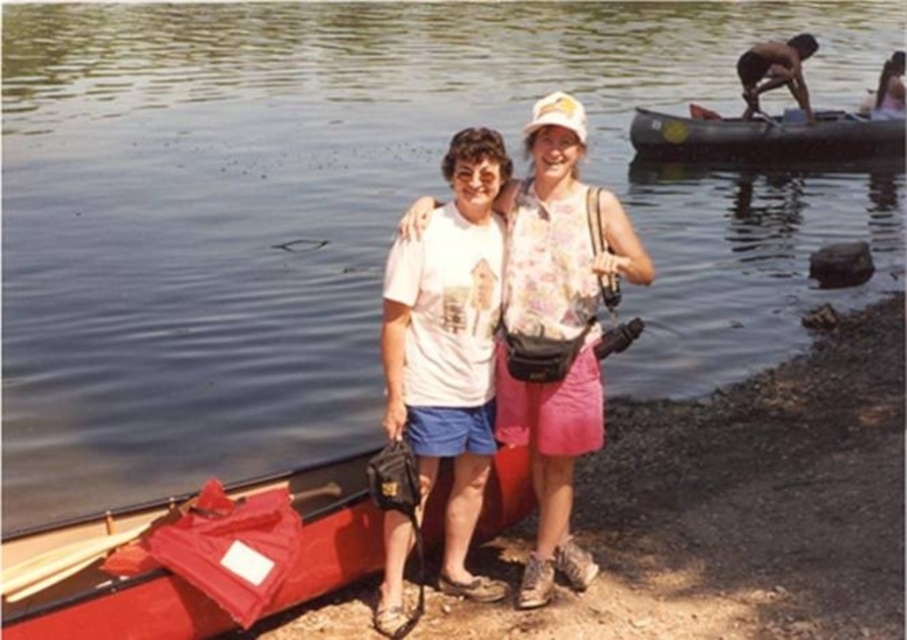
Question: Based on their relative distances, which object is nearer to the wooden paddle at lower left?

Choices:
 (A) red plastic canoe at lower left
 (B) white cotton shirt at center

Answer: (A)

Question: Which object appears closest to the camera in this image?

Choices:
 (A) rubberized black canoe at right
 (B) white cotton shirt at center
 (C) red plastic canoe at lower left

Answer: (C)

Question: In this image, where is red plastic canoe at lower left located relative to rubberized black canoe at right?

Choices:
 (A) right
 (B) left

Answer: (B)

Question: Can you confirm if rubberized black canoe at right is positioned below skinny man at upper right?

Choices:
 (A) no
 (B) yes

Answer: (B)

Question: Estimate the real-world distances between objects in this image. Which object is closer to the skinny man at upper right?

Choices:
 (A) white cotton shirt at center
 (B) rubberized black canoe at right
 (C) red plastic canoe at lower left
 (D) wooden paddle at lower left

Answer: (B)

Question: Can you confirm if rubberized black canoe at right is thinner than skinny man at upper right?

Choices:
 (A) yes
 (B) no

Answer: (A)